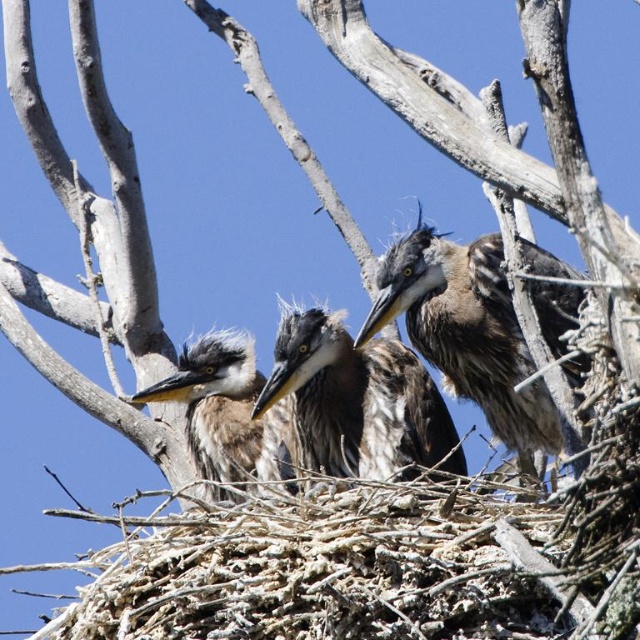
Question: Does grayish-brown feathers at center have a greater width compared to gray downy feathers at center?

Choices:
 (A) yes
 (B) no

Answer: (A)

Question: Which object appears closest to the camera in this image?

Choices:
 (A) gray fluffy heron at center
 (B) gray downy feathers at center
 (C) grayish-brown feathers at center

Answer: (A)

Question: Can you confirm if gray fluffy heron at center is bigger than grayish-brown feathers at center?

Choices:
 (A) yes
 (B) no

Answer: (A)

Question: Is the position of gray fluffy heron at center less distant than that of grayish-brown feathers at center?

Choices:
 (A) yes
 (B) no

Answer: (A)

Question: Which of the following is the closest to the observer?

Choices:
 (A) gray downy feathers at center
 (B) gray fluffy heron at center

Answer: (B)

Question: Which point is closer to the camera taking this photo?

Choices:
 (A) (310, 413)
 (B) (180, 356)
 (C) (477, 310)

Answer: (C)